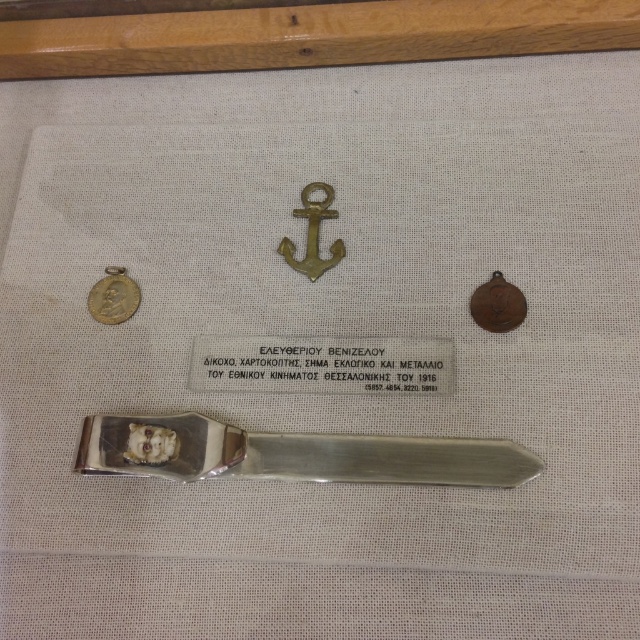
You are a museum curator arranging artifacts in a display case. You have a silver metallic letter opener at center and a gold plated coin at left. Which object is closer to the viewer?

The silver metallic letter opener at center is closer to the viewer because it is in front of the gold plated coin at left.

You are a museum curator arranging artifacts in a display case. You need to place a new item between the brass anchor at center and the rectangular plaque below it. The new item must be positioned exactly at point (292, 452). Based on the existing layout, can you confirm if this point is currently occupied by an object?

The point (292, 452) is occupied by a silver metallic letter opener at center, so placing the new item there would displace the existing object.

In the scene shown: You are a museum curator arranging artifacts in a display case. You have a silver metallic letter opener at center and a gold plated coin at left. Which object requires more space to display properly?

The silver metallic letter opener at center is larger in size than the gold plated coin at left, so it requires more space to display properly.